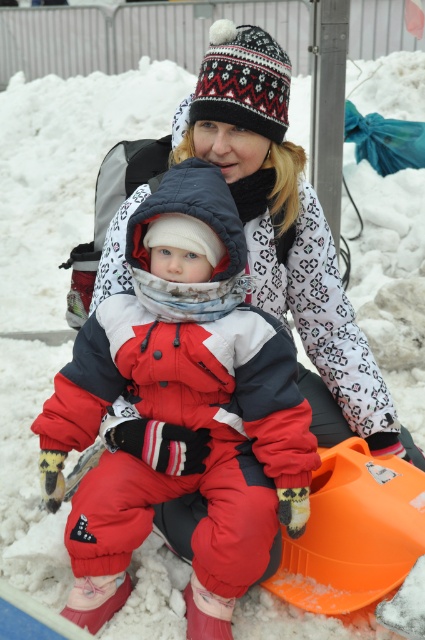
You are trying to locate the red fleece snowsuit at center and the white knit hat at upper center in the winter scene. According to the spatial arrangement, which object is positioned to the right?

The white knit hat at upper center is to the right of the red fleece snowsuit at center.